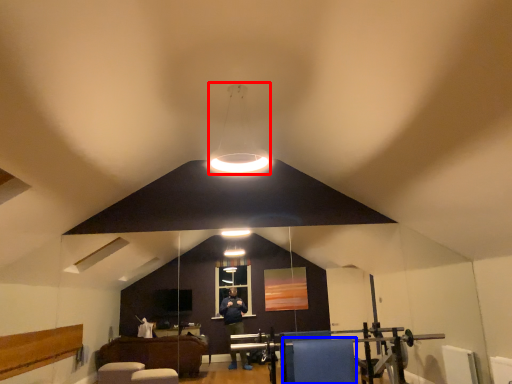
Question: Which point is closer to the camera, lamp (highlighted by a red box) or furniture (highlighted by a blue box)?

Choices:
 (A) lamp
 (B) furniture

Answer: (A)